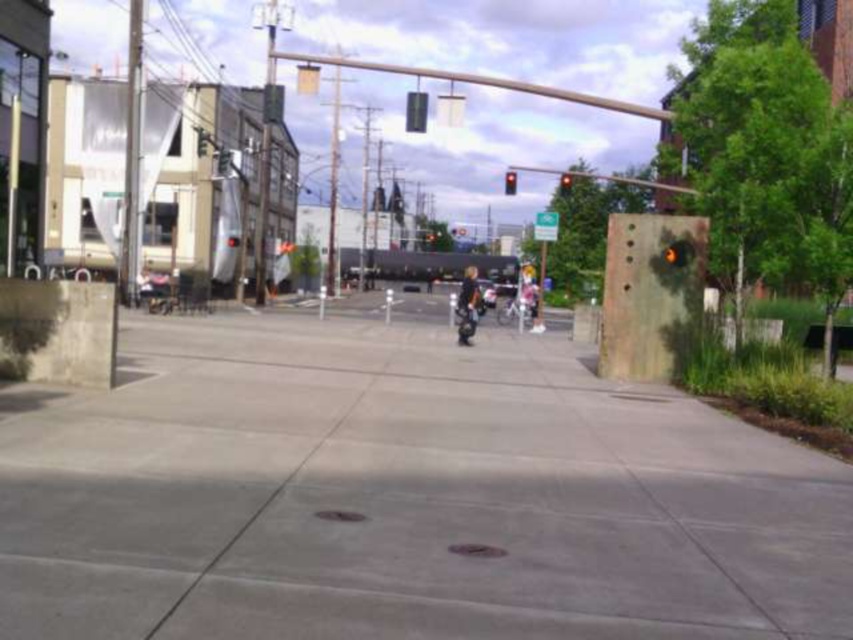
Who is more forward, (405, 100) or (672, 244)?

Positioned in front is point (672, 244).

Can you confirm if metallic traffic light at center is taller than black glass traffic light at center?

Correct, metallic traffic light at center is much taller as black glass traffic light at center.

Between point (424, 104) and point (685, 243), which one is positioned in front?

Positioned in front is point (685, 243).

Image resolution: width=853 pixels, height=640 pixels. Identify the location of metallic traffic light at center. point(416,112).

Can you confirm if green plastic sign at center is positioned to the left of black glass traffic light at center?

In fact, green plastic sign at center is to the right of black glass traffic light at center.

Can you confirm if green plastic sign at center is bigger than black glass traffic light at center?

Yes, green plastic sign at center is bigger than black glass traffic light at center.

Who is more forward, (537, 221) or (672, 248)?

Positioned in front is point (672, 248).

Locate an element on the screen. The image size is (853, 640). green plastic sign at center is located at coordinates (544, 225).

Locate an element on the screen. The image size is (853, 640). gray concrete pavement at center is located at coordinates (403, 496).

Is gray concrete pavement at center above black glass traffic light at center?

Actually, gray concrete pavement at center is below black glass traffic light at center.

Is point (334, 451) more distant than point (672, 250)?

No, it is not.

Where is `gray concrete pavement at center`? The image size is (853, 640). gray concrete pavement at center is located at coordinates (403, 496).